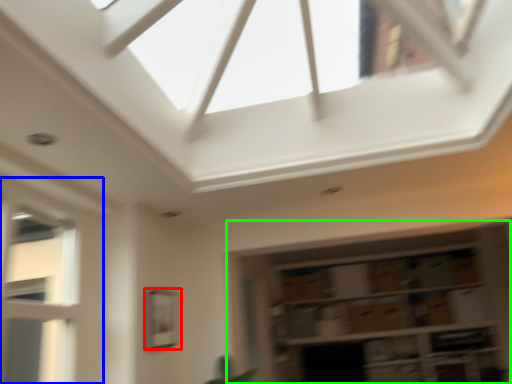
Question: Which object is positioned closest to window (highlighted by a red box)? Select from window (highlighted by a blue box) and shelf (highlighted by a green box).

Choices:
 (A) window
 (B) shelf

Answer: (A)